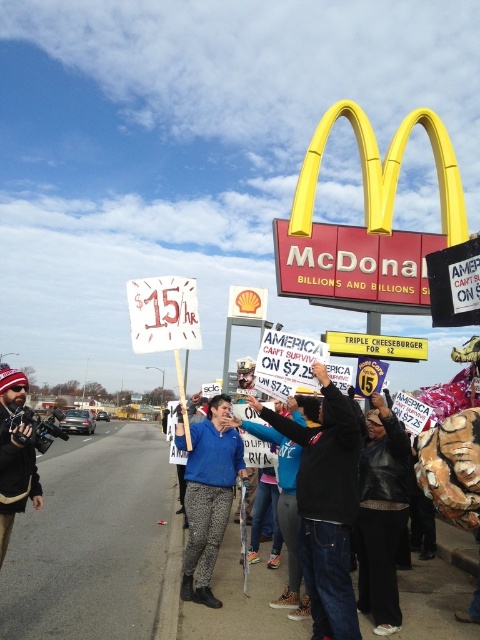
Between blue denim jeans at center and black leather jacket at center, which one appears on the right side from the viewer's perspective?

From the viewer's perspective, black leather jacket at center appears more on the right side.

Does point (302, 461) come closer to viewer compared to point (379, 595)?

No, it is not.

The image size is (480, 640). Identify the location of blue denim jeans at center. (325, 506).

Is point (305, 429) closer to viewer compared to point (216, 410)?

Yes, it is in front of point (216, 410).

Can you confirm if blue denim jeans at center is positioned below blue fabric jacket at center?

No.

Does point (326, 445) come farther from viewer compared to point (216, 465)?

That is False.

Locate an element on the screen. blue denim jeans at center is located at coordinates (325, 506).

Between black leather jacket at center and blue fabric jacket at center, which one is positioned lower?

blue fabric jacket at center

Does black leather jacket at center have a smaller size compared to blue fabric jacket at center?

Yes.

At what (x,y) coordinates should I click in order to perform the action: click on black leather jacket at center. Please return your answer as a coordinate pair (x, y). Looking at the image, I should click on (381, 515).

Locate an element on the screen. black leather jacket at center is located at coordinates (381, 515).